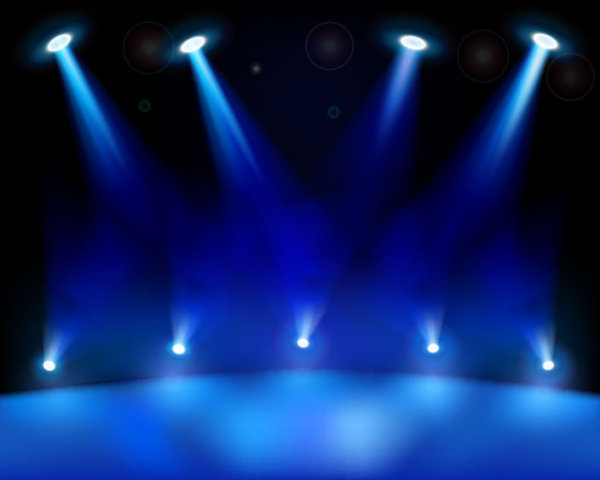
At what (x,y) coordinates should I click in order to perform the action: click on spotlights on top. Please return your answer as a coordinate pair (x, y). Looking at the image, I should click on (101, 144), (228, 133), (384, 115), (506, 133).